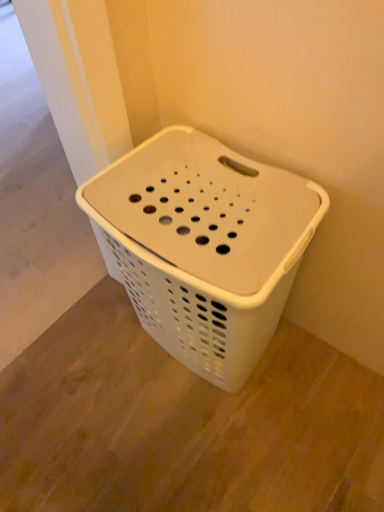
Find the location of `free point in front of white plastic laundry basket at center`. free point in front of white plastic laundry basket at center is located at coordinates (223, 450).